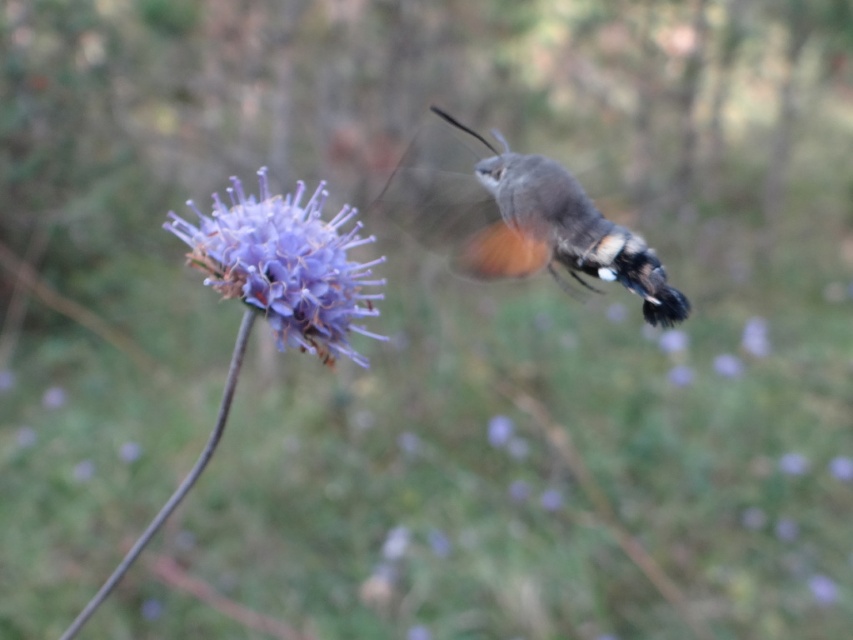
Who is shorter, gray matte moth at upper right or purple fluffy flower at center?

Standing shorter between the two is purple fluffy flower at center.

Can you confirm if gray matte moth at upper right is positioned to the left of purple fluffy flower at center?

Incorrect, gray matte moth at upper right is not on the left side of purple fluffy flower at center.

The image size is (853, 640). Identify the location of gray matte moth at upper right. (517, 218).